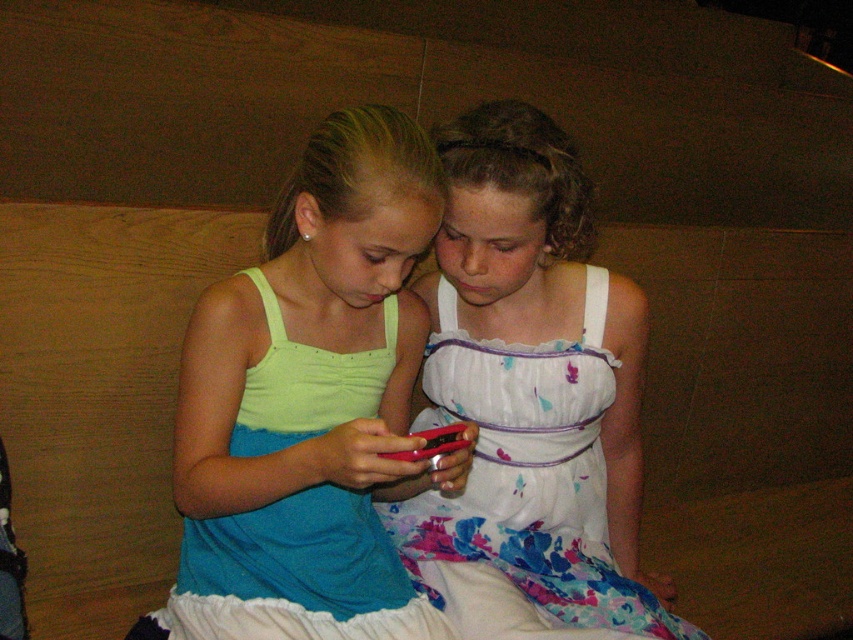
You are a photographer trying to capture a clear shot of the matte red phone at center. The matte green tank top at center is blocking your view. Can you move the phone without moving the tank top to get an unobstructed view?

The matte green tank top at center is positioned over the matte red phone at center, so moving the phone without moving the tank top would still leave the tank top obstructing the view.

You are a photographer trying to capture a clear shot of the matte red phone at center. However, the white floral fabric dress at center is blocking your view. Can you move the dress to get a better angle?

The matte red phone at center is behind the white floral fabric dress at center, so moving the dress would allow you to see the phone more clearly.

You are a photographer trying to capture a closeup of the matte red phone at center without the white floral fabric dress at center overlapping it. Based on their sizes, is this possible?

The white floral fabric dress at center has a larger size compared to matte red phone at center, so it might be difficult to avoid overlapping since the dress is bigger. Position the phone carefully to ensure it is not covered by the dress.